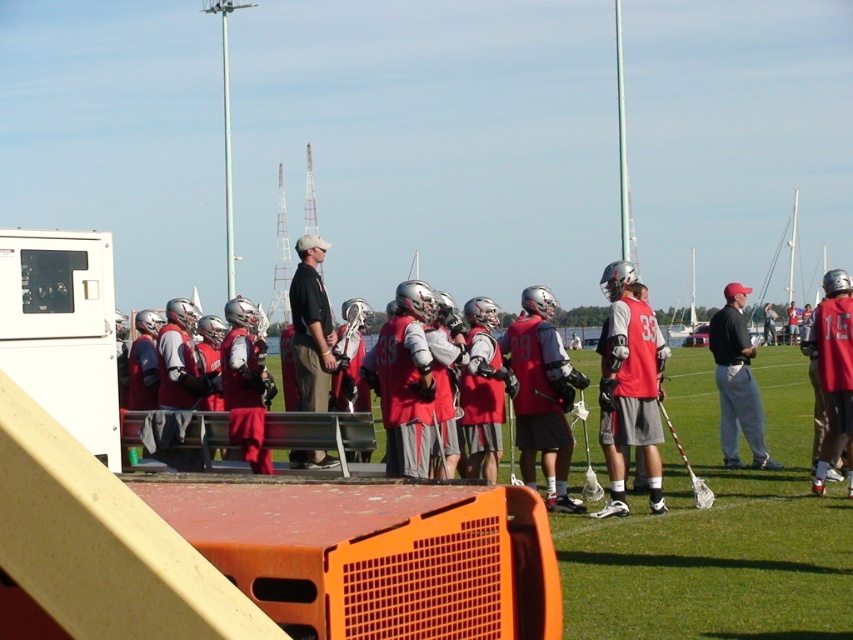
Question: Can you confirm if red matte jersey at center is bigger than matte black shirt at center?

Choices:
 (A) no
 (B) yes

Answer: (B)

Question: Which point appears closest to the camera in this image?

Choices:
 (A) (403, 426)
 (B) (651, 496)
 (C) (747, 364)

Answer: (A)

Question: Which point is farther to the camera?

Choices:
 (A) black smooth shirt at center
 (B) matte red lacrosse uniform at center

Answer: (B)

Question: Which point appears closest to the camera in this image?

Choices:
 (A) (602, 333)
 (B) (299, 464)
 (C) (462, 417)

Answer: (C)

Question: Where is red matte jersey at center located in relation to matte red lacrosse uniform at center in the image?

Choices:
 (A) above
 (B) below

Answer: (B)

Question: Where is matte red lacrosse uniform at center located in relation to black smooth shirt at center in the image?

Choices:
 (A) above
 (B) below

Answer: (A)